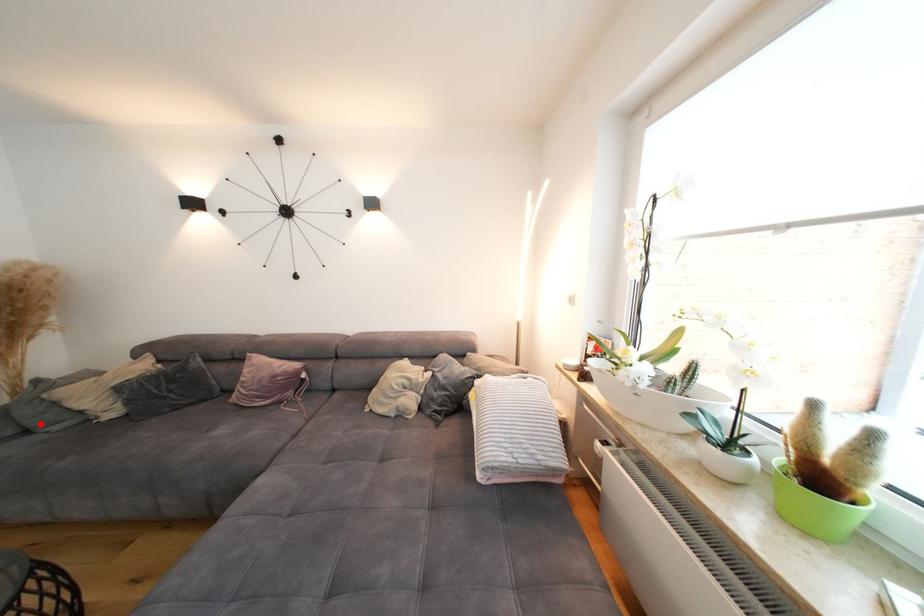
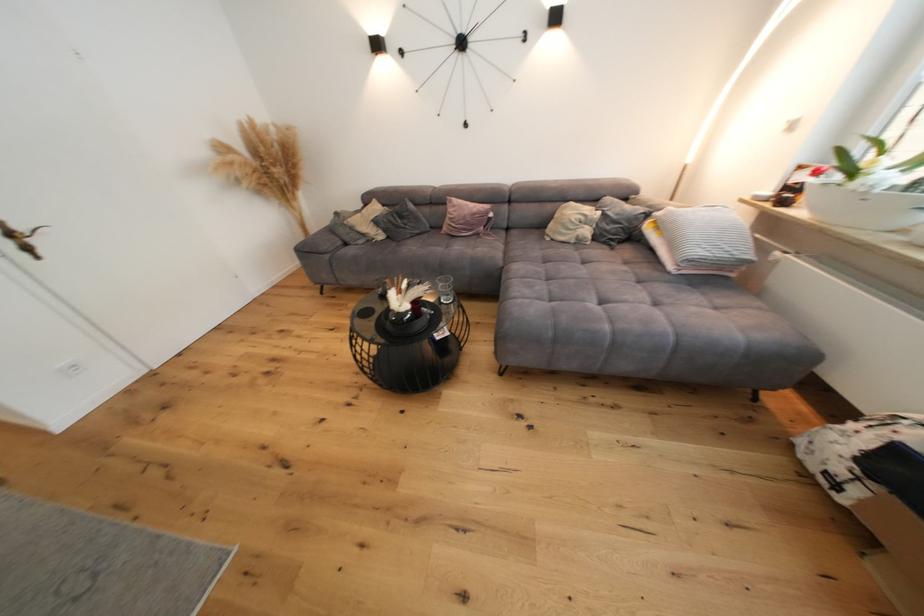
Question: I am providing you with two images of the same scene from different viewpoints. A red point is marked on the first image. Can you still see the location of the red point in image 2?

Choices:
 (A) Yes
 (B) No

Answer: (A)